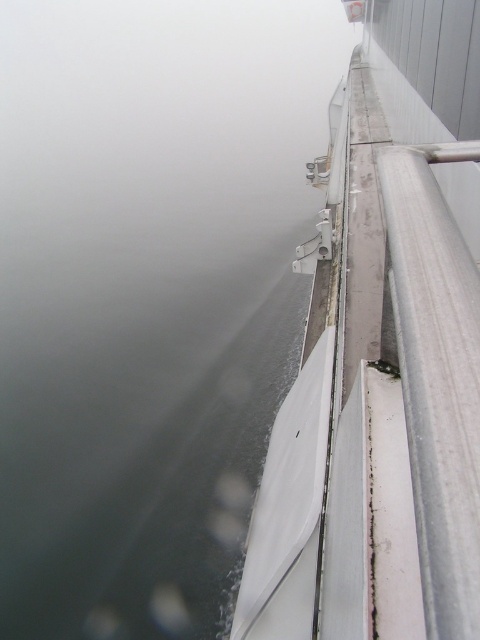
Does gray matte water at upper left have a lesser width compared to white matte boat at upper right?

No, gray matte water at upper left is not thinner than white matte boat at upper right.

Can you confirm if gray matte water at upper left is positioned to the right of white matte boat at upper right?

In fact, gray matte water at upper left is to the left of white matte boat at upper right.

Which is in front, point (36, 269) or point (252, 564)?

Point (252, 564)

Where is `gray matte water at upper left`? Image resolution: width=480 pixels, height=640 pixels. gray matte water at upper left is located at coordinates (147, 296).